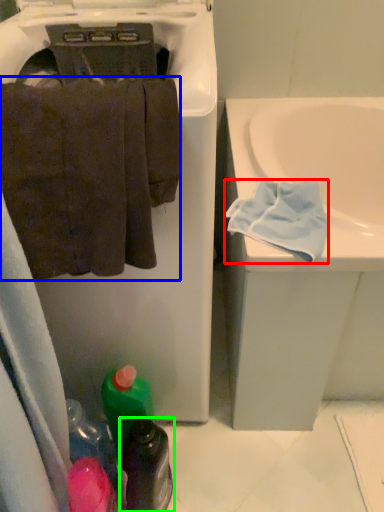
Question: Considering the real-world distances, which object is farthest from bath towel (highlighted by a red box)? towel (highlighted by a blue box) or bottle (highlighted by a green box)?

Choices:
 (A) towel
 (B) bottle

Answer: (B)